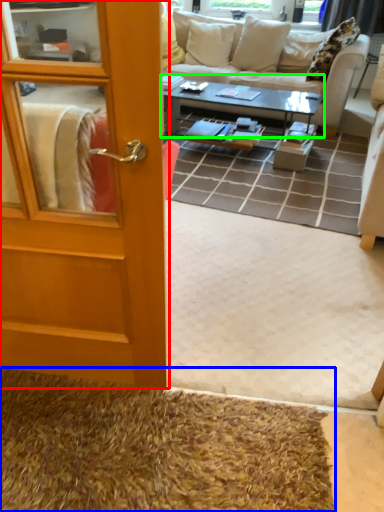
Question: Which object is positioned closest to door (highlighted by a red box)? Select from doormat (highlighted by a blue box) and coffee table (highlighted by a green box).

Choices:
 (A) doormat
 (B) coffee table

Answer: (A)